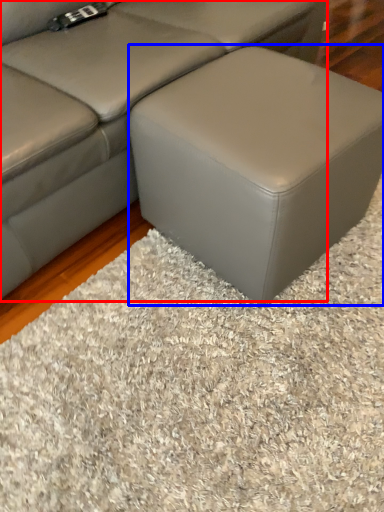
Question: Which object is further to the camera taking this photo, studio couch (highlighted by a red box) or stool (highlighted by a blue box)?

Choices:
 (A) studio couch
 (B) stool

Answer: (B)